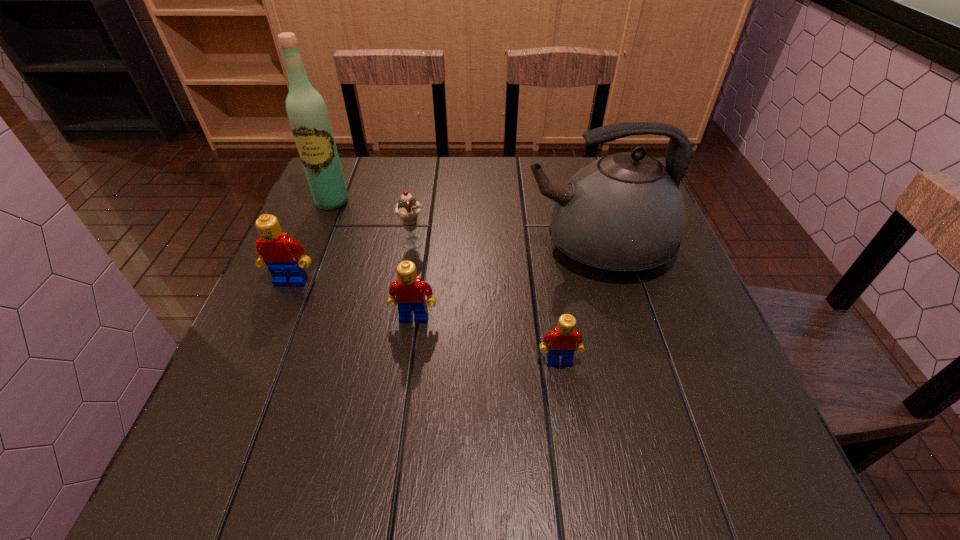
You are a GUI agent. You are given a task and a screenshot of the screen. Output one action in this format:
    pyautogui.click(x=<x>, y=<y>)
    Task: Click on the free spot between the second Lego from right to left and the second tallest object
    The height and width of the screenshot is (540, 960).
    Given the screenshot: What is the action you would take?
    (x=506, y=282)

Find the location of a particular element. Image resolution: width=960 pixels, height=540 pixels. free spot between the farthest Lego and the icecream is located at coordinates (352, 263).

Where is `vacant space in between the kettle and the nearest object`? The width and height of the screenshot is (960, 540). vacant space in between the kettle and the nearest object is located at coordinates (579, 304).

You are a GUI agent. You are given a task and a screenshot of the screen. Output one action in this format:
    pyautogui.click(x=<x>, y=<y>)
    Task: Click on the free space that is in between the fifth shortest object and the tallest object
    Image resolution: width=960 pixels, height=540 pixels.
    Given the screenshot: What is the action you would take?
    pyautogui.click(x=465, y=225)

At what (x,y) coordinates should I click in order to perform the action: click on vacant area that lies between the second tallest object and the second Lego from left to right. Please return your answer as a coordinate pair (x, y). Image resolution: width=960 pixels, height=540 pixels. Looking at the image, I should click on (x=506, y=282).

Where is `object that is the second closest to the wine bottle`? Image resolution: width=960 pixels, height=540 pixels. object that is the second closest to the wine bottle is located at coordinates (276, 249).

Identify which object is the fourth nearest to the kettle. Please provide its 2D coordinates. Your answer should be formatted as a tuple, i.e. [(x, y)], where the tuple contains the x and y coordinates of a point satisfying the conditions above.

[(308, 116)]

Identify which Lego is located as the second nearest to the fifth shortest object. Please provide its 2D coordinates. Your answer should be formatted as a tuple, i.e. [(x, y)], where the tuple contains the x and y coordinates of a point satisfying the conditions above.

[(409, 292)]

Identify which Lego is located as the second nearest to the wine bottle. Please provide its 2D coordinates. Your answer should be formatted as a tuple, i.e. [(x, y)], where the tuple contains the x and y coordinates of a point satisfying the conditions above.

[(409, 292)]

Identify the location of vacant space that satisfies the following two spatial constraints: 1. on the front-facing side of the wine bottle; 2. on the left side of the icecream. (315, 244).